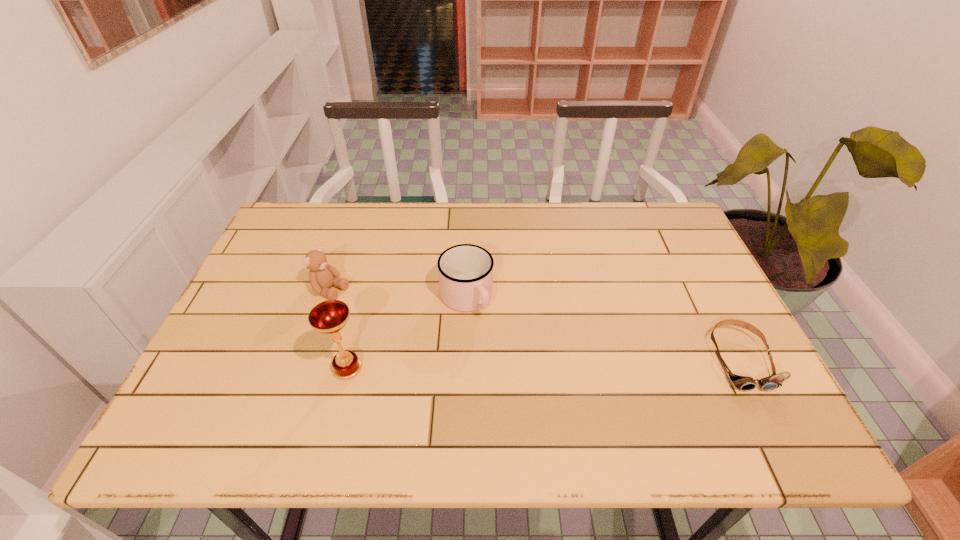
In the image, there is a desktop. Identify the location of free space at the far left corner. The image size is (960, 540). [x=330, y=218].

Identify the location of vacant space at the far right corner of the desktop. Image resolution: width=960 pixels, height=540 pixels. (653, 237).

You are a GUI agent. You are given a task and a screenshot of the screen. Output one action in this format:
    pyautogui.click(x=<x>, y=<y>)
    Task: Click on the vacant space that is in between the rightmost object and the teddy bear
    
    Given the screenshot: What is the action you would take?
    pyautogui.click(x=536, y=325)

You are a GUI agent. You are given a task and a screenshot of the screen. Output one action in this format:
    pyautogui.click(x=<x>, y=<y>)
    Task: Click on the blank region between the rightmost object and the teddy bear
    The height and width of the screenshot is (540, 960).
    Given the screenshot: What is the action you would take?
    pyautogui.click(x=536, y=325)

Identify the location of free point between the leftmost object and the second object from right to left. This screenshot has width=960, height=540. (398, 295).

I want to click on empty location between the goggles and the mug, so click(603, 329).

Locate an element on the screen. free point between the mug and the leftmost object is located at coordinates (398, 295).

Where is `vacant region between the goggles and the chalice`? The height and width of the screenshot is (540, 960). vacant region between the goggles and the chalice is located at coordinates (543, 363).

Find the location of a particular element. The image size is (960, 540). unoccupied position between the teddy bear and the goggles is located at coordinates (536, 325).

Identify the location of object that is the second closest one to the mug. (322, 276).